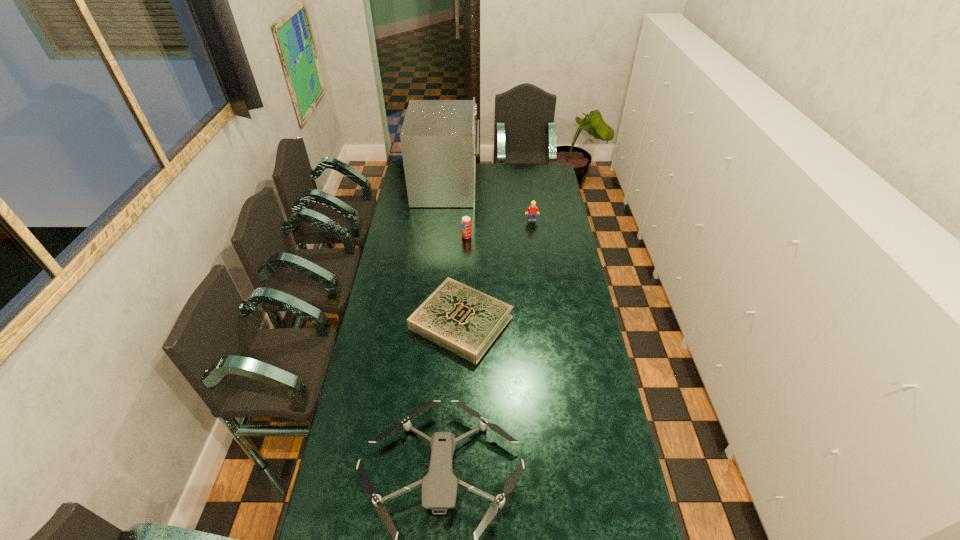
Find the location of `the tallest object`. the tallest object is located at coordinates (437, 138).

Find the location of a particular element. Image resolution: width=960 pixels, height=540 pixels. toaster oven is located at coordinates (437, 138).

The image size is (960, 540). I want to click on Lego, so click(x=531, y=211).

The image size is (960, 540). In order to click on the rightmost object in this screenshot , I will do `click(531, 211)`.

The height and width of the screenshot is (540, 960). In order to click on the third farthest object in this screenshot , I will do `click(466, 221)`.

Locate an element on the screen. The height and width of the screenshot is (540, 960). hardback book is located at coordinates (465, 321).

Identify the location of the fourth farthest object. The image size is (960, 540). (465, 321).

Where is `vacant space located on the front panel of the toaster oven`? The height and width of the screenshot is (540, 960). vacant space located on the front panel of the toaster oven is located at coordinates (496, 187).

The image size is (960, 540). I want to click on vacant region located on the front-facing side of the Lego, so click(x=534, y=233).

Locate an element on the screen. The width and height of the screenshot is (960, 540). vacant region located 0.100m on the front of the third nearest object is located at coordinates (467, 253).